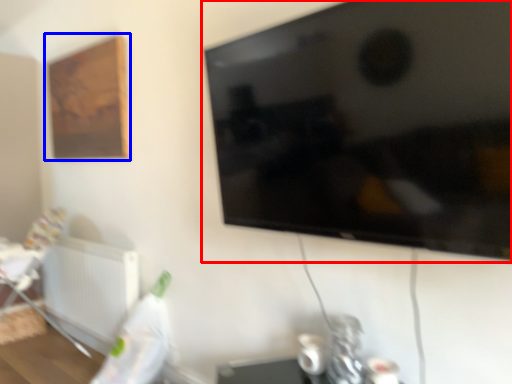
Question: Among these objects, which one is farthest to the camera, television (highlighted by a red box) or picture frame (highlighted by a blue box)?

Choices:
 (A) television
 (B) picture frame

Answer: (B)